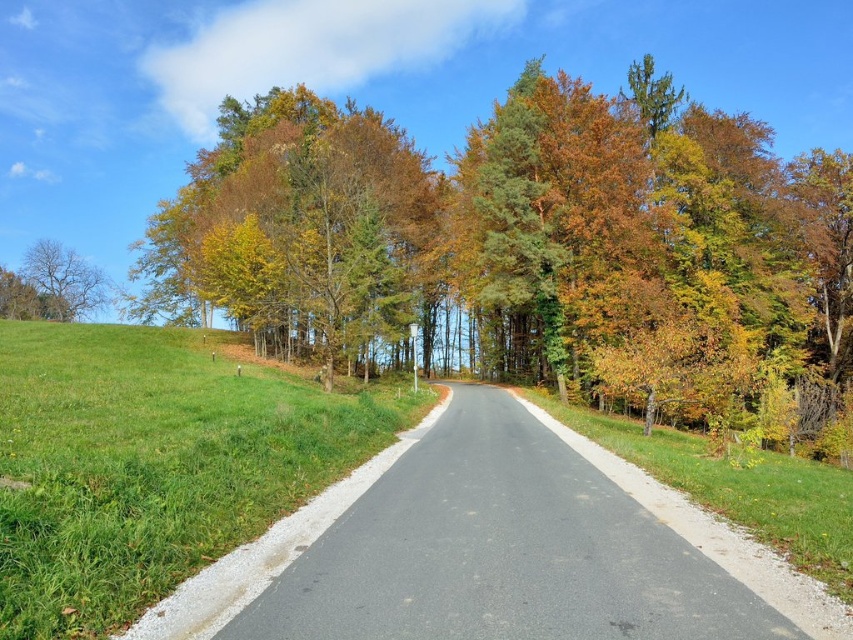
Question: Among these objects, which one is nearest to the camera?

Choices:
 (A) bare branches at left
 (B) green leafy tree at center
 (C) green grass at left

Answer: (C)

Question: In this image, where is green grass at left located relative to green grass at right?

Choices:
 (A) below
 (B) above

Answer: (B)

Question: Which object is positioned closest to the bare branches at left?

Choices:
 (A) green grass at left
 (B) green leafy tree at center
 (C) green grass at right

Answer: (B)

Question: Estimate the real-world distances between objects in this image. Which object is closer to the green grass at right?

Choices:
 (A) green grass at left
 (B) green leafy tree at center

Answer: (A)

Question: Where is green grass at left located in relation to green grass at right in the image?

Choices:
 (A) above
 (B) below

Answer: (A)

Question: Observing the image, what is the correct spatial positioning of green leafy tree at center in reference to green grass at left?

Choices:
 (A) right
 (B) left

Answer: (B)